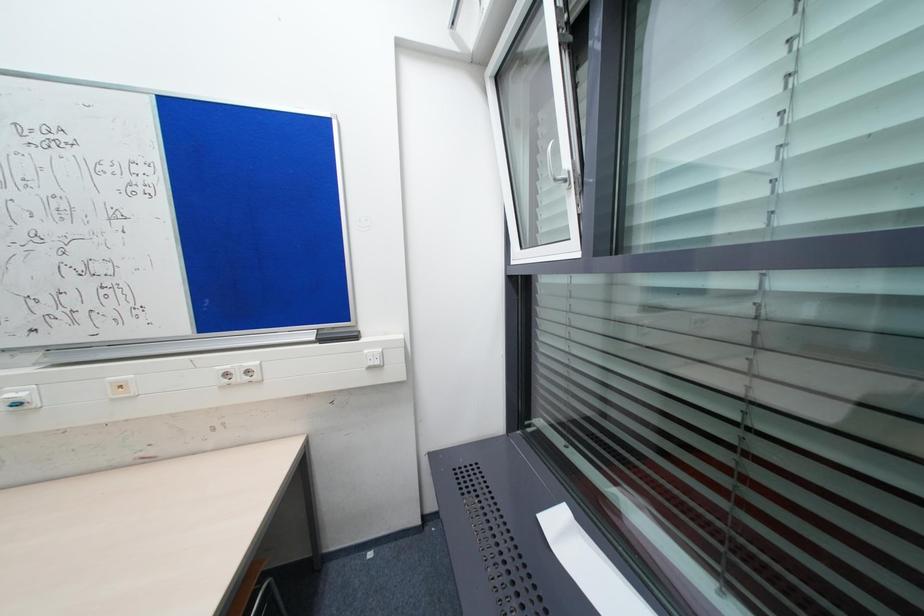
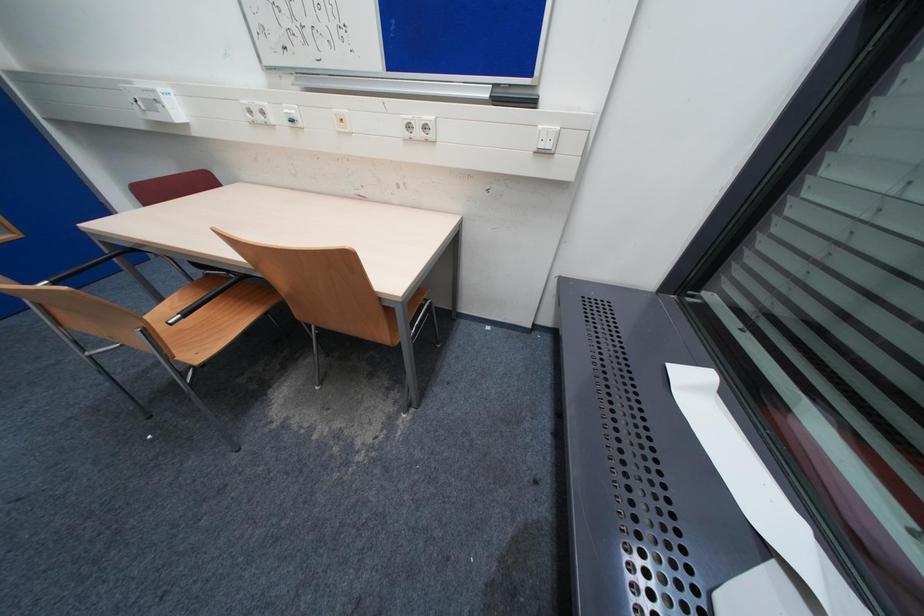
Based on the continuous images, in which direction is the camera rotating?

The camera's rotation is toward left-down.